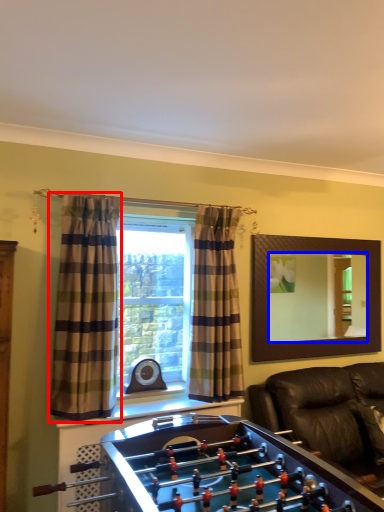
Question: Which of the following is the farthest to the observer, curtain (highlighted by a red box) or mirror (highlighted by a blue box)?

Choices:
 (A) curtain
 (B) mirror

Answer: (B)